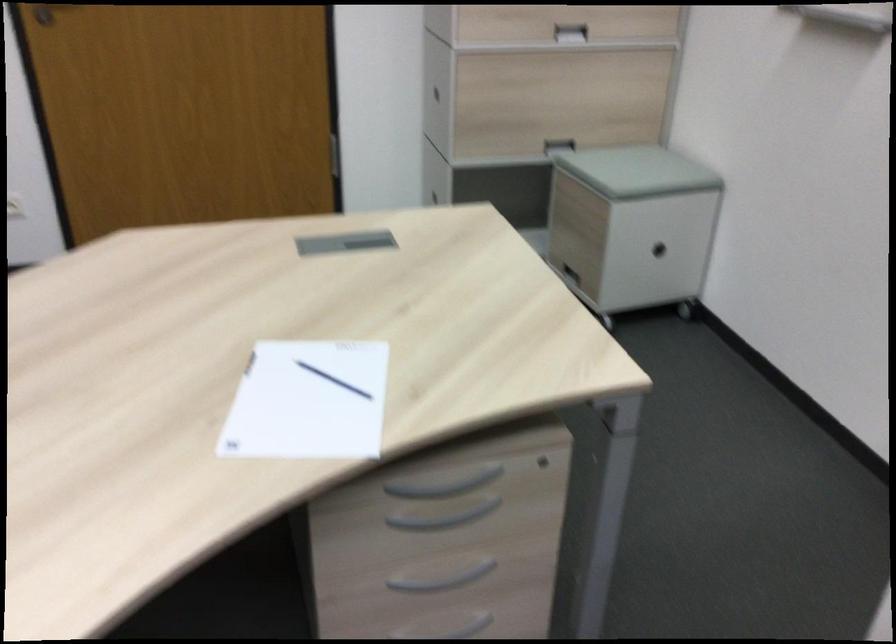
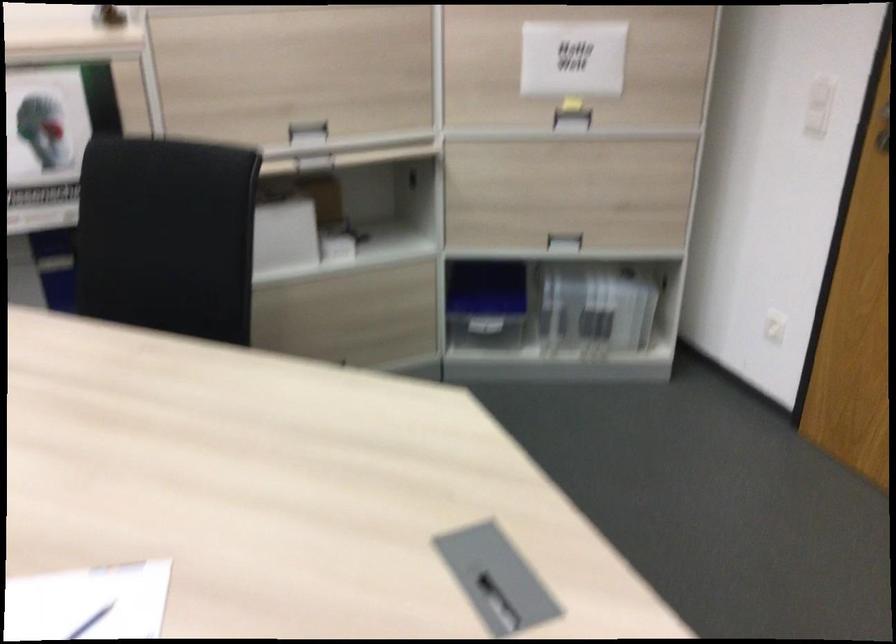
Locate, in the second image, the point that corresponds to pixel 359 254 in the first image.

(497, 603)